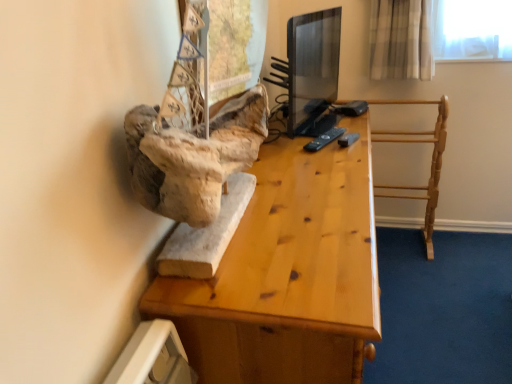
Image resolution: width=512 pixels, height=384 pixels. I want to click on free location in front of black plastic remote at center, so click(x=329, y=153).